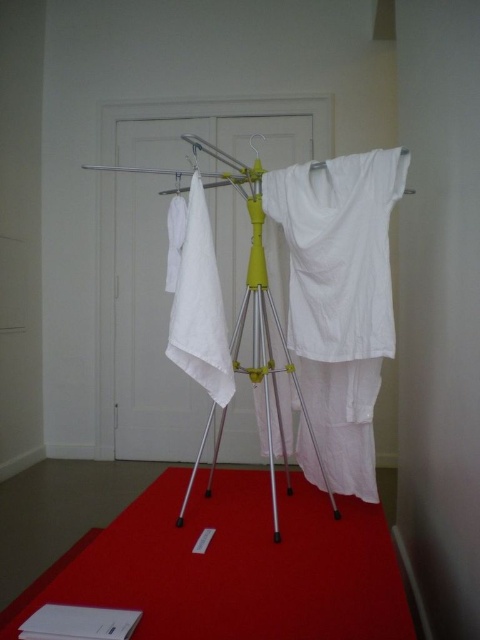
You are trying to place a small potted plant between the red carpet at lower center and the yellow metallic tripod at center. Based on the scene description, can the plant fit between them?

The red carpet at lower center might be wider than yellow metallic tripod at center, so there might be enough space for the plant between them.

Consider the image. You are standing at the entrance of the room and want to place a new drying rack. The existing drying rack is next to the white door. Where should you place the new rack to avoid overlapping with the red carpet at lower center?

The red carpet at lower center is located at point (238, 564), so you should place the new rack away from that coordinate to avoid overlapping with the red carpet at lower center.